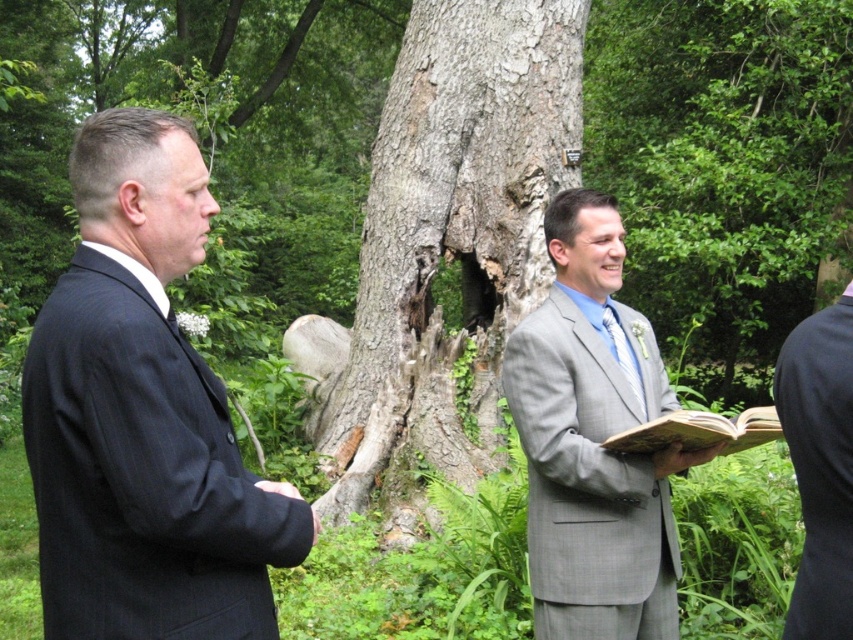
You are a photographer at a wedding in a forest. You need to position the black pinstripe suit at left and the gray rough bark tree trunk at center in your shot. Which object is shorter?

The black pinstripe suit at left is shorter than the gray rough bark tree trunk at center.

You are a photographer at a wedding in the forest. You need to position the black pinstripe suit at left and the gray rough bark tree trunk at center in your shot. Based on their positions, which object is closer to the camera?

The black pinstripe suit at left is below the gray rough bark tree trunk at center, meaning it is closer to the camera.